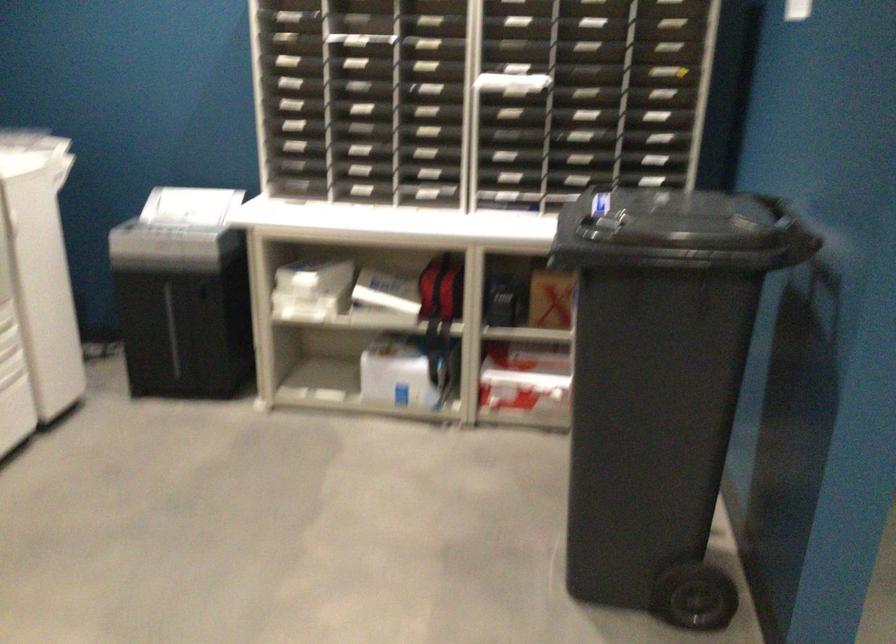
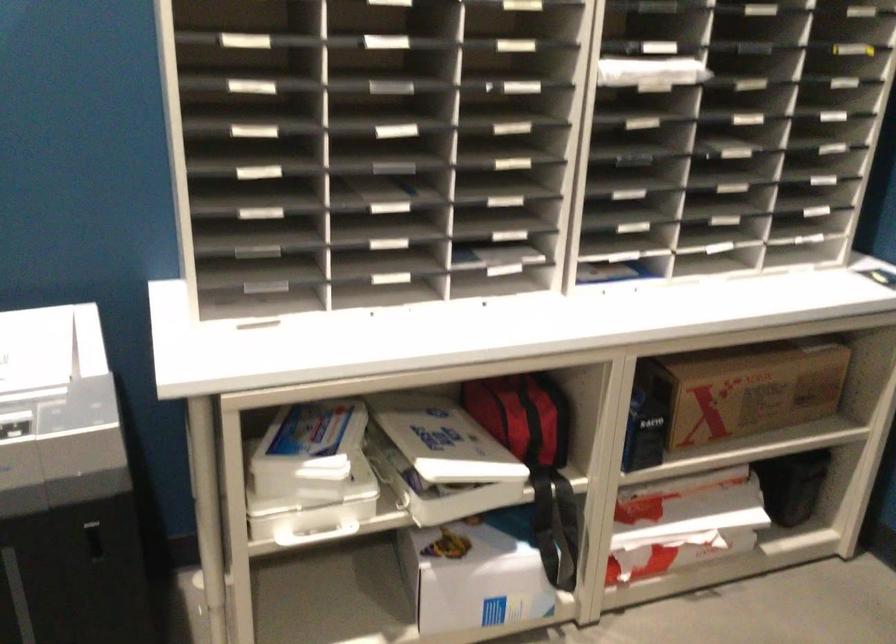
The images are taken continuously from a first-person perspective. In which direction are you moving?

The movement direction of the cameraman is left, forward.